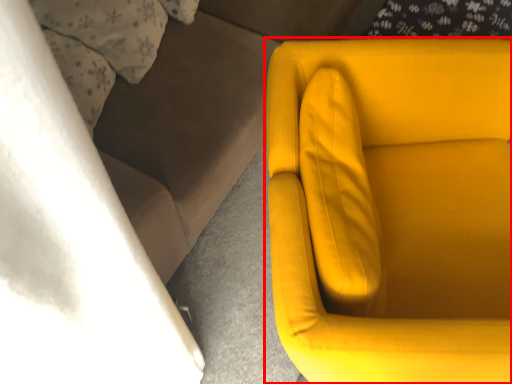
Question: In this image, where is chair (annotated by the red box) located relative to couch?

Choices:
 (A) left
 (B) right

Answer: (B)